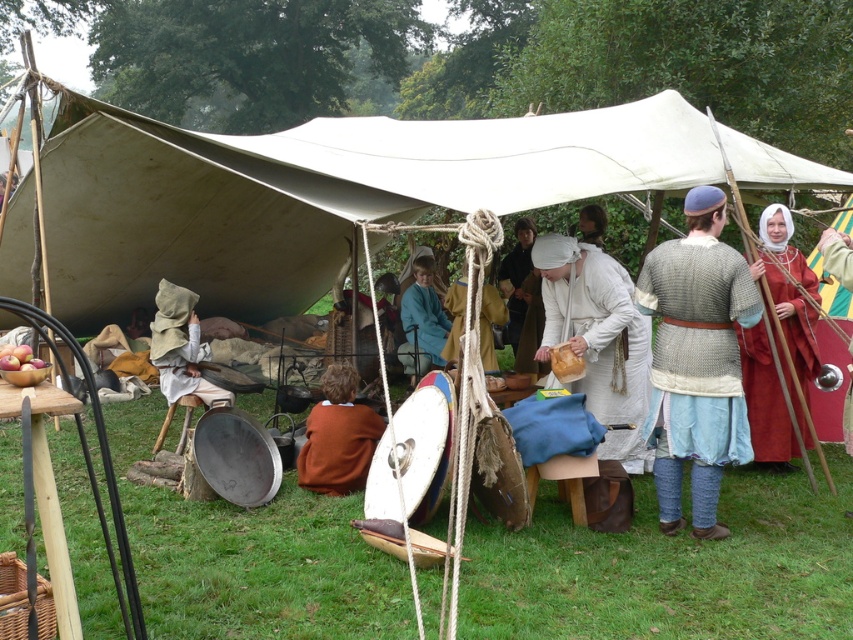
You are an observer standing at the entrance of the tent. You see the white linen dress at center and the brown wool sweater at lower center. Which one is closer to you?

The white linen dress at center is closer to you because it is in front of the brown wool sweater at lower center.

You are organizing a costume fitting session for a historical reenactment. You have a participant wearing the white linen dress at center and another wearing the brown wool sweater at lower center. Which costume requires more fabric to make?

The white linen dress at center requires more fabric to make because it has a larger size compared to the brown wool sweater at lower center.

You are a guest at this historical reenactment and need to pass between the white linen dress at center and the brown wool sweater at lower center. The path between them is narrow. Can you walk through comfortably? Please explain your reasoning.

The distance between the white linen dress at center and the brown wool sweater at lower center is 4.75 feet. Since the average person requires about 2.5 to 3 feet of space to walk comfortably, this distance should be sufficient for you to pass through without difficulty.